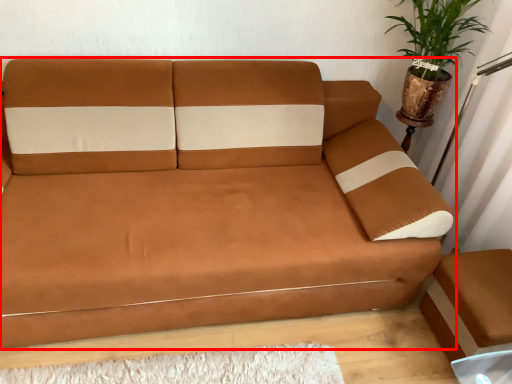
Question: From the image, what is the correct spatial relationship of studio couch (annotated by the red box) in relation to houseplant?

Choices:
 (A) right
 (B) left

Answer: (B)